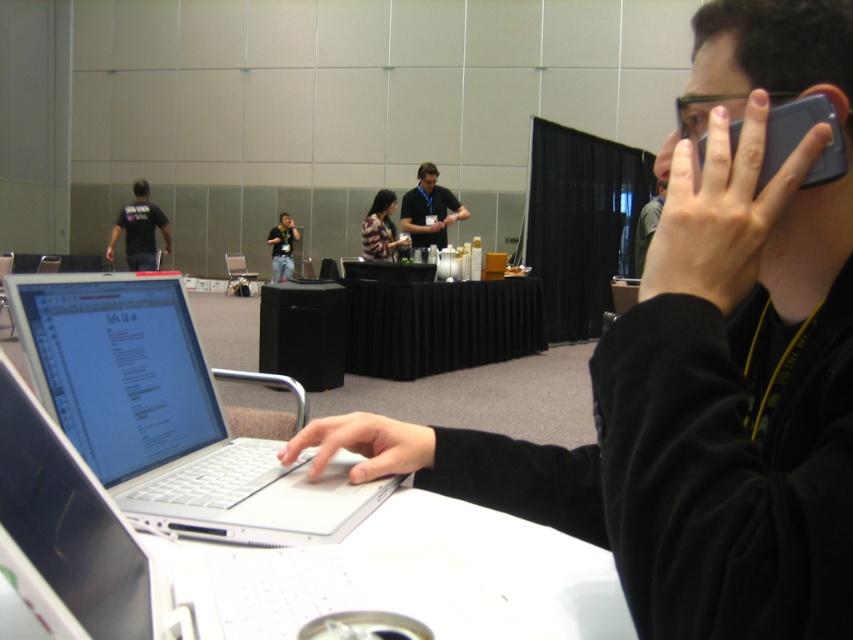
Is black fabric shirt at upper left wider than striped fabric shirt at center?

Yes, black fabric shirt at upper left is wider than striped fabric shirt at center.

Who is more distant from viewer, (141, 189) or (384, 202)?

The point (141, 189) is behind.

Locate an element on the screen. The width and height of the screenshot is (853, 640). black fabric shirt at upper left is located at coordinates (138, 228).

Which is more to the left, black shirt at center or black fabric shirt at upper left?

black fabric shirt at upper left is more to the left.

Can you confirm if black shirt at center is positioned below black fabric shirt at upper left?

Incorrect, black shirt at center is not positioned below black fabric shirt at upper left.

Does point (444, 243) come in front of point (149, 268)?

Yes.

Identify the location of black shirt at center. This screenshot has width=853, height=640. (428, 209).

Can you confirm if black shirt at center is shorter than matte black shirt at upper right?

Correct, black shirt at center is not as tall as matte black shirt at upper right.

From the picture: Can you confirm if black shirt at center is wider than matte black shirt at upper right?

In fact, black shirt at center might be narrower than matte black shirt at upper right.

The height and width of the screenshot is (640, 853). Identify the location of black shirt at center. pos(428,209).

Find the location of `black shirt at center`. black shirt at center is located at coordinates (428, 209).